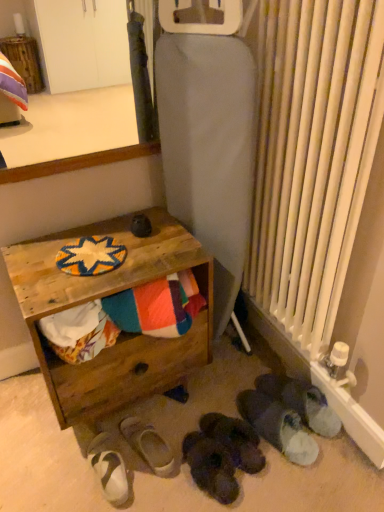
The width and height of the screenshot is (384, 512). What are the coordinates of `blank space to the left of white suede sandals at lower left, which ranks as the 1th footwear in left-to-right order` in the screenshot? It's located at (50, 469).